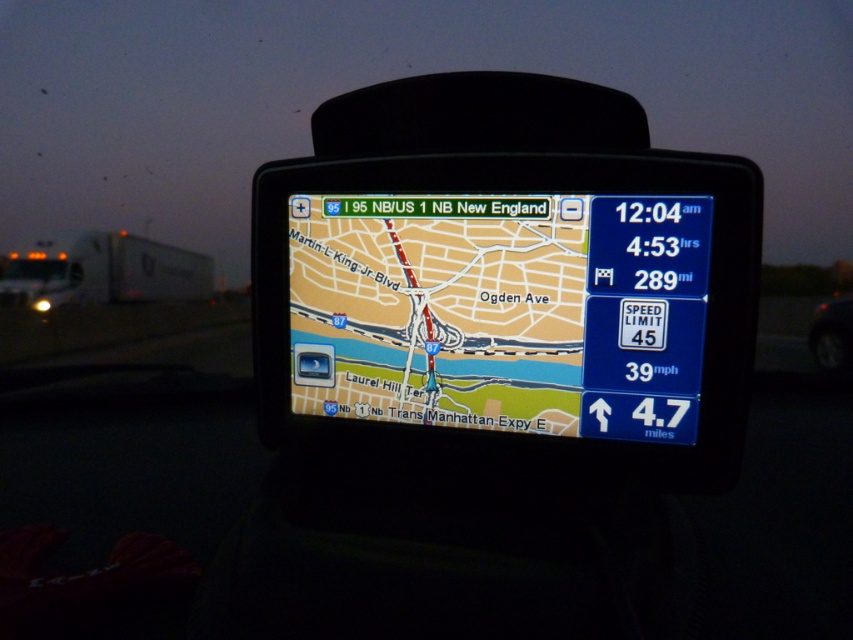
You are a driver using the GPS navigation device. You notice two points marked on the screen. The first point is at coordinates point (x=643, y=371) and the second point is at point (x=834, y=346). Which point appears closer to you on the GPS screen?

Point (x=643, y=371) is closer to the viewer than point (x=834, y=346), so the first point appears closer on the GPS screen.

You are a delivery driver who needs to check both the beige paper map at center and the shiny black tire at lower right during your route. If your arm can reach 36 inches, can you comfortably reach both items from your current position?

The beige paper map at center is 35.75 inches from the shiny black tire at lower right, so yes, you can comfortably reach both items since the distance between them is within your 36 inch reach.